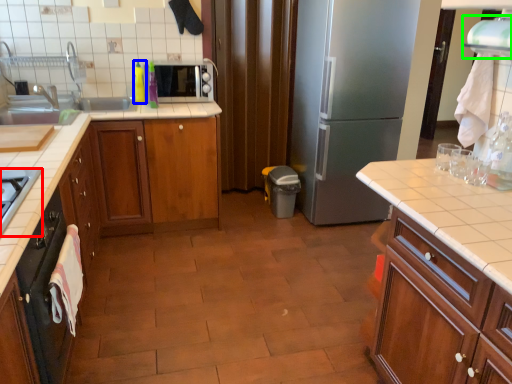
Question: Estimate the real-world distances between objects in this image. Which object is farther from gas stove (highlighted by a red box), bottle (highlighted by a blue box) or exhaust hood (highlighted by a green box)?

Choices:
 (A) bottle
 (B) exhaust hood

Answer: (B)